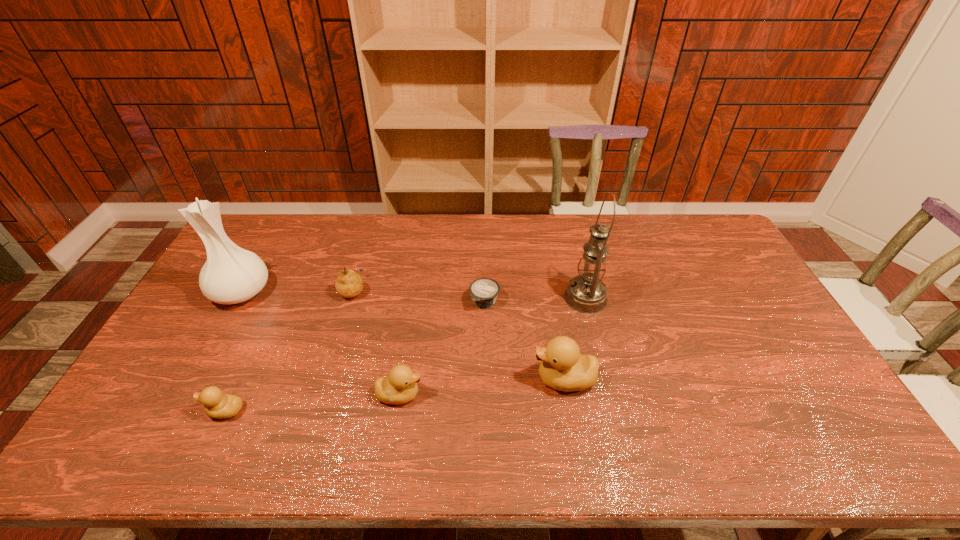
Identify the location of oil lamp. (586, 293).

Find the location of a particular element. Image resolution: width=960 pixels, height=540 pixels. free location located facing forward on the leftmost duckling is located at coordinates (186, 410).

The image size is (960, 540). What are the coordinates of `free location located 0.310m facing forward on the second tallest duckling` in the screenshot? It's located at (540, 394).

This screenshot has height=540, width=960. I want to click on blank space located facing forward on the tallest duckling, so click(451, 379).

Find the location of `vacant space located facing forward on the tallest duckling`. vacant space located facing forward on the tallest duckling is located at coordinates (484, 379).

The height and width of the screenshot is (540, 960). Identify the location of free space located 0.310m facing forward on the tallest duckling. (418, 379).

Find the location of `vacant region located on the right of the vase`. vacant region located on the right of the vase is located at coordinates click(314, 292).

Where is `free space located 0.280m on the left of the pear`? The width and height of the screenshot is (960, 540). free space located 0.280m on the left of the pear is located at coordinates (254, 290).

Where is `vacant area situated on the left of the yogurt`? The width and height of the screenshot is (960, 540). vacant area situated on the left of the yogurt is located at coordinates (413, 301).

The height and width of the screenshot is (540, 960). Find the location of `free space located on the left of the oil lamp`. free space located on the left of the oil lamp is located at coordinates (496, 298).